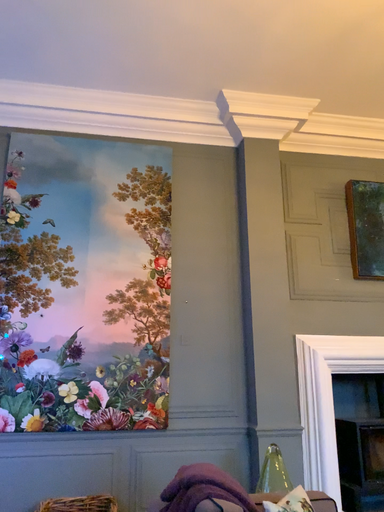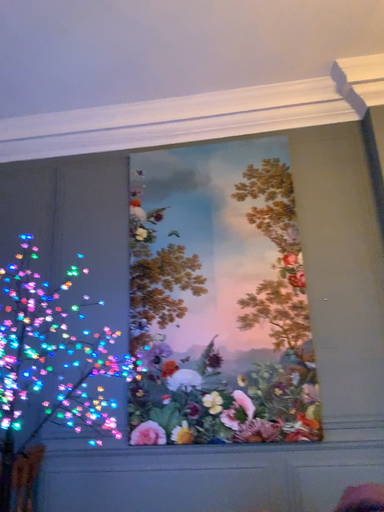
Question: Which way did the camera rotate in the video?

Choices:
 (A) rotated right
 (B) rotated left

Answer: (B)